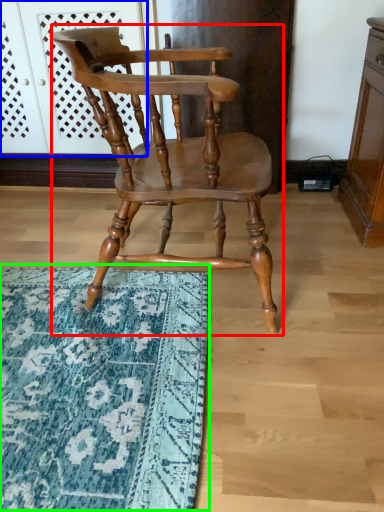
Question: Considering the real-world distances, which object is closest to chair (highlighted by a red box)? screen door (highlighted by a blue box) or mat (highlighted by a green box).

Choices:
 (A) screen door
 (B) mat

Answer: (B)